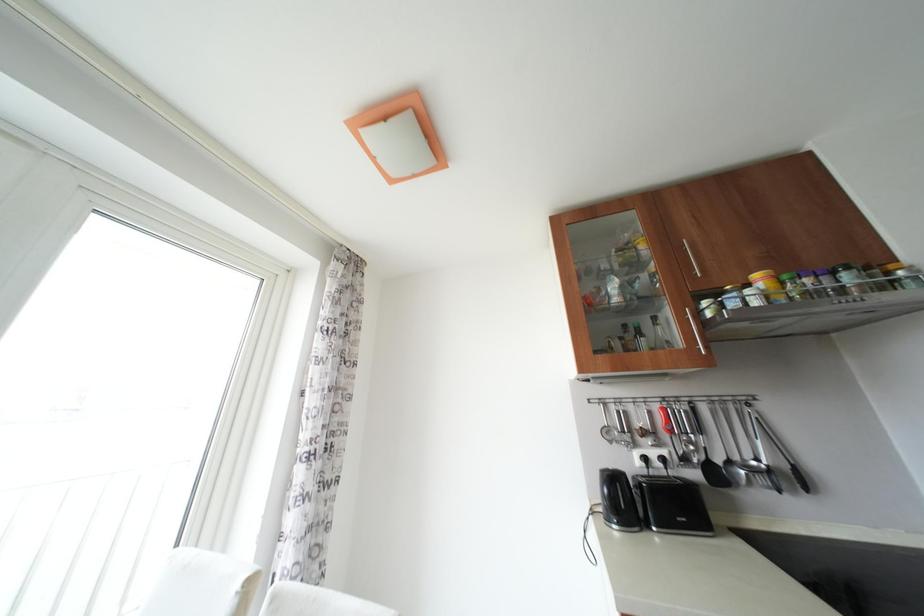
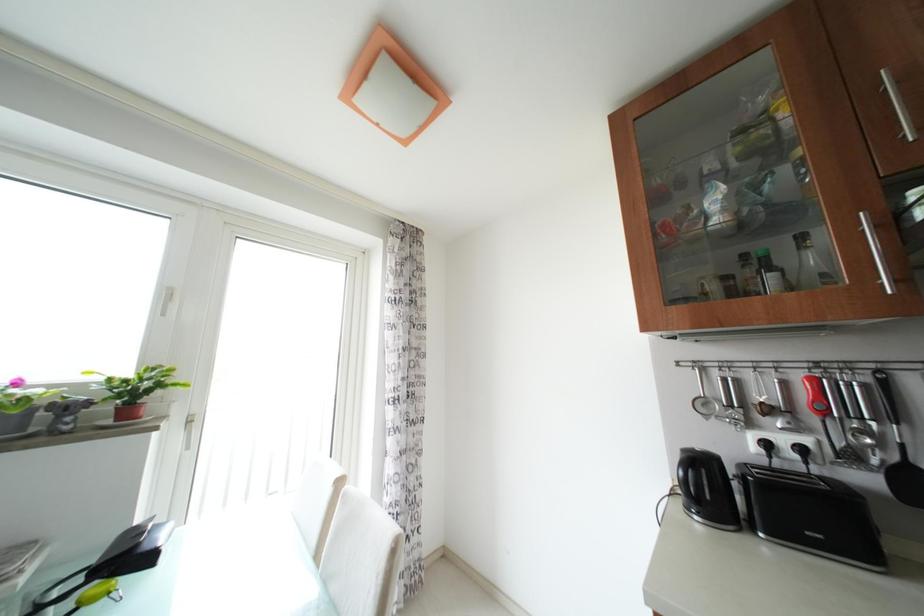
Question: What movement of the cameraman would produce the second image?

Choices:
 (A) Left
 (B) Right
 (C) Forward
 (D) Backward

Answer: (B)